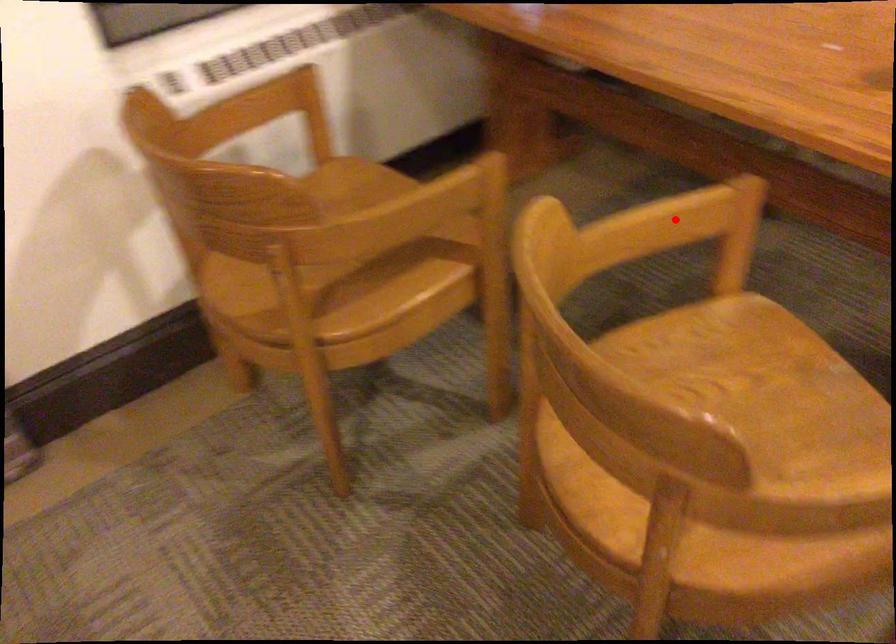
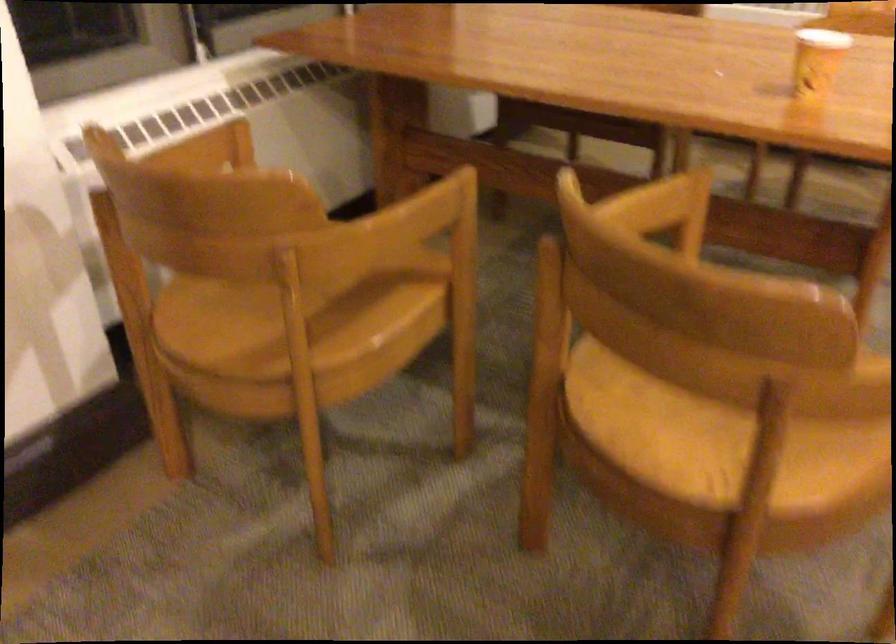
The point at the highlighted location is marked in the first image. Where is the corresponding point in the second image?

(650, 205)